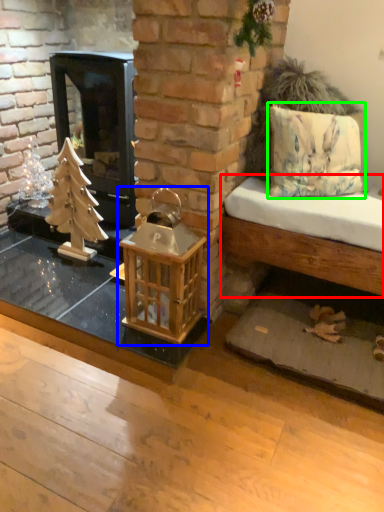
Question: Which object is positioned closest to furniture (highlighted by a red box)? Select from bird cage (highlighted by a blue box) and pillow (highlighted by a green box).

Choices:
 (A) bird cage
 (B) pillow

Answer: (B)